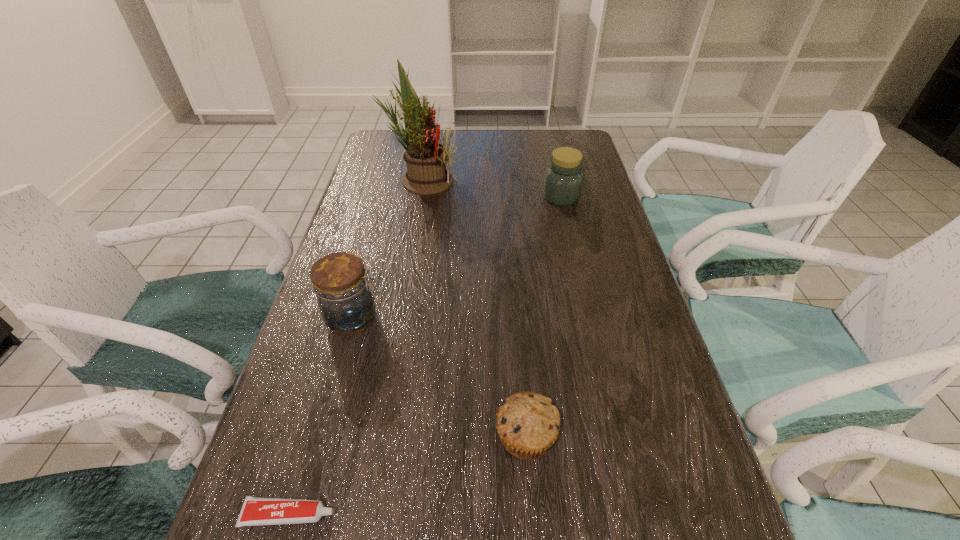
Where is `free space located on the lid of the third farthest object`? The image size is (960, 540). free space located on the lid of the third farthest object is located at coordinates (450, 319).

Where is `free space located 0.280m on the back of the rightmost object`? The image size is (960, 540). free space located 0.280m on the back of the rightmost object is located at coordinates (548, 143).

The height and width of the screenshot is (540, 960). What are the coordinates of `blank space located 0.120m on the back of the muffin` in the screenshot? It's located at (519, 355).

Identify the location of vacant position located 0.230m at the nozzle of the shortest object. [482, 515].

Find the location of a particular element. The image size is (960, 540). flower arrangement that is positioned at the left edge is located at coordinates (426, 159).

You are a GUI agent. You are given a task and a screenshot of the screen. Output one action in this format:
    pyautogui.click(x=<x>, y=<y>)
    Task: Click on the jar that is positioned at the left edge
    The height and width of the screenshot is (540, 960).
    Given the screenshot: What is the action you would take?
    [340, 282]

Find the location of a particular element. The width and height of the screenshot is (960, 540). toothpaste present at the left edge is located at coordinates (255, 511).

Where is `object that is at the right edge`? The width and height of the screenshot is (960, 540). object that is at the right edge is located at coordinates (x=563, y=179).

In the image, there is a desktop. Identify the location of vacant region at the left edge. (406, 167).

The image size is (960, 540). I want to click on free space at the right edge of the desktop, so click(x=622, y=364).